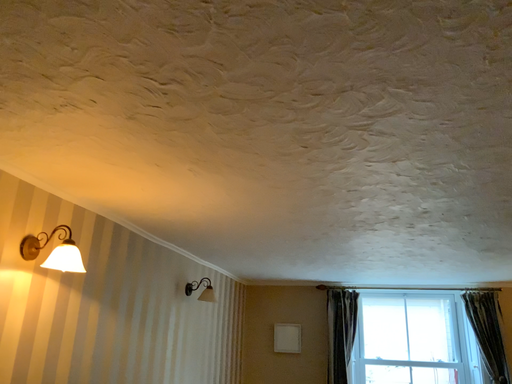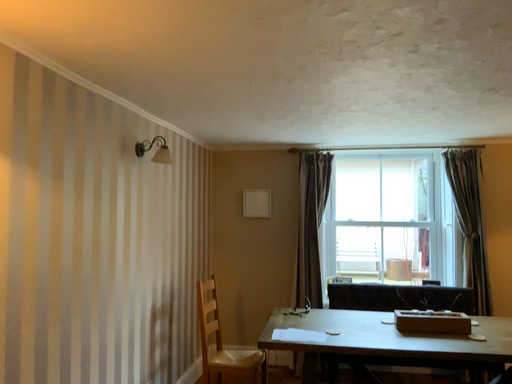
Question: Which way did the camera rotate in the video?

Choices:
 (A) rotated upward
 (B) rotated downward

Answer: (B)